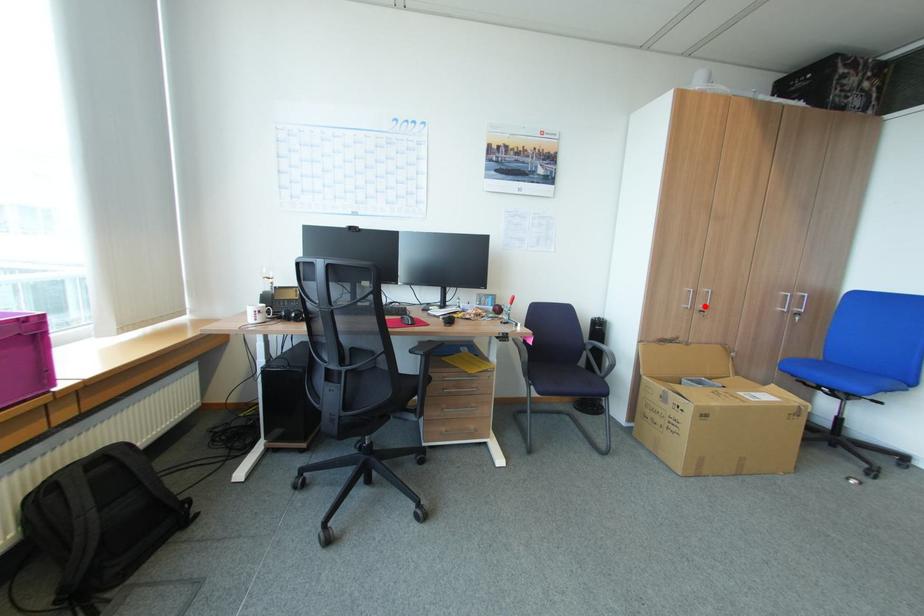
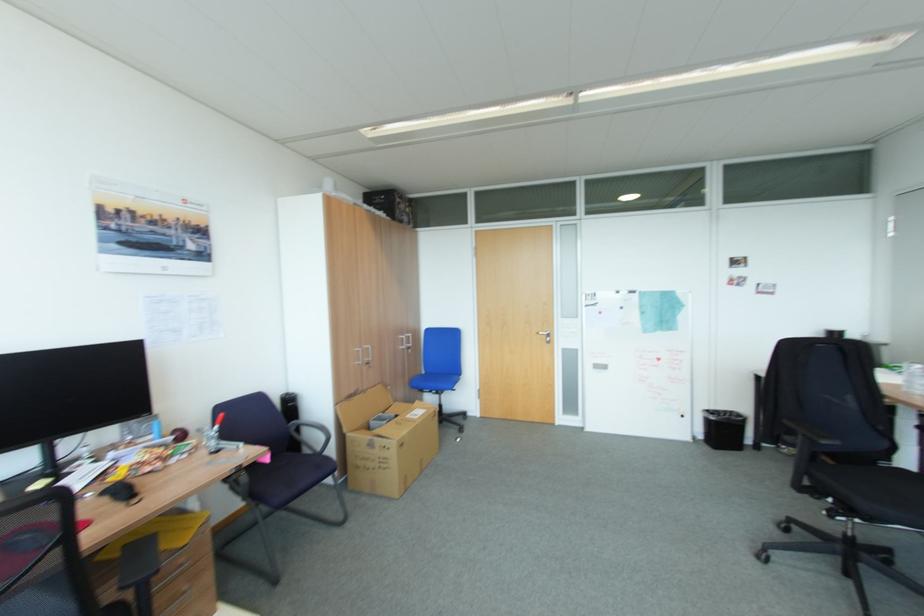
In the second image, find the point that corresponds to the highlighted location in the first image.

(371, 360)